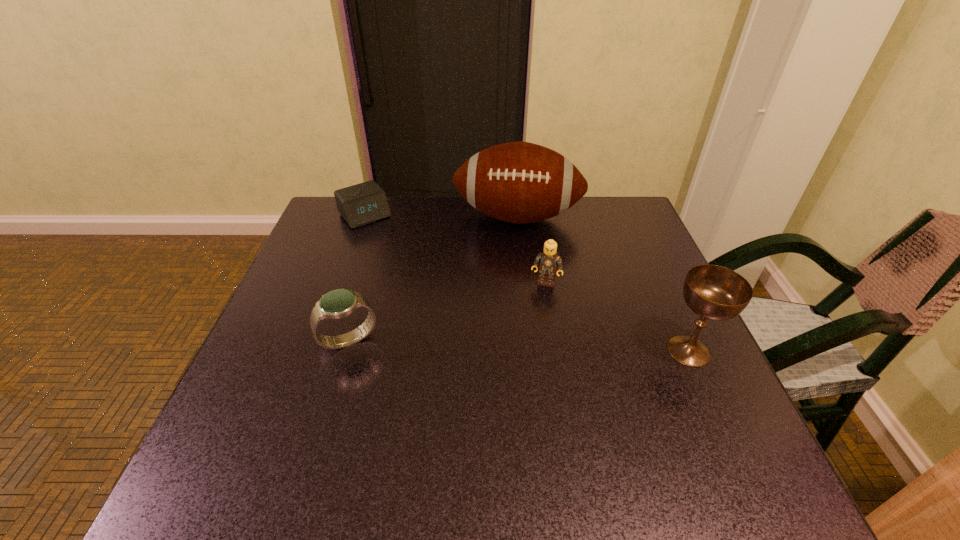
The height and width of the screenshot is (540, 960). What are the coordinates of `vacant space situated 0.400m on the laces of the football` in the screenshot? It's located at (496, 359).

Locate an element on the screen. Image resolution: width=960 pixels, height=540 pixels. vacant region located 0.070m on the front-facing side of the shortest object is located at coordinates (386, 240).

Where is `vacant space located on the front-facing side of the shortest object`? The width and height of the screenshot is (960, 540). vacant space located on the front-facing side of the shortest object is located at coordinates (395, 249).

In order to click on free space located 0.350m on the front-facing side of the shortest object in this screenshot , I will do point(438,301).

Image resolution: width=960 pixels, height=540 pixels. I want to click on free point located in front of the third farthest object, so click(510, 417).

I want to click on vacant space positioned in front of the third farthest object, so click(x=532, y=328).

Image resolution: width=960 pixels, height=540 pixels. In order to click on vacant space situated in front of the third farthest object in this screenshot , I will do `click(537, 312)`.

In order to click on football present at the far edge in this screenshot , I will do `click(518, 182)`.

Where is `alarm clock that is positioned at the far edge`? The image size is (960, 540). alarm clock that is positioned at the far edge is located at coordinates (364, 203).

This screenshot has height=540, width=960. In order to click on watch at the left edge in this screenshot , I will do 339,303.